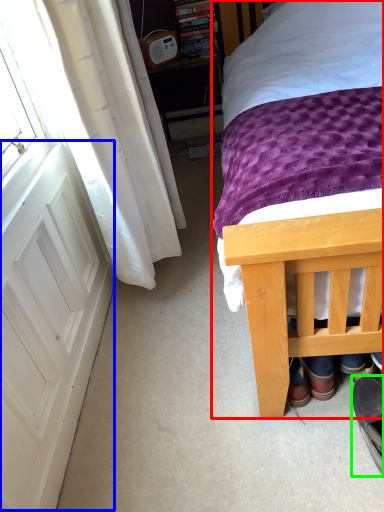
Question: Which object is positioned closest to bed (highlighted by a red box)? Select from screen door (highlighted by a blue box) and footwear (highlighted by a green box).

Choices:
 (A) screen door
 (B) footwear

Answer: (A)